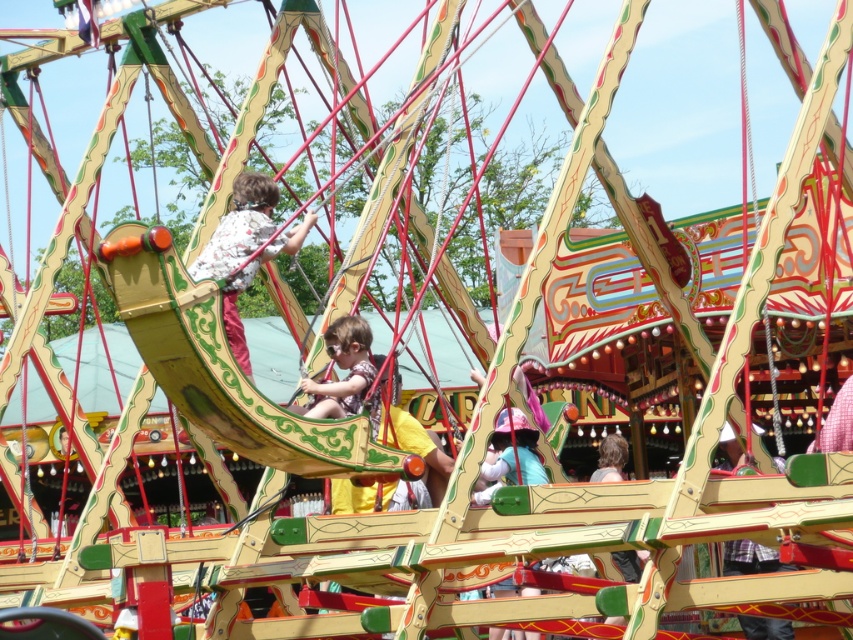
Question: Is floral shirt fabric at center to the right of matte yellow swing at center from the viewer's perspective?

Choices:
 (A) yes
 (B) no

Answer: (B)

Question: Which object appears closest to the camera in this image?

Choices:
 (A) floral shirt fabric at center
 (B) matte yellow swing at center

Answer: (A)

Question: Observing the image, what is the correct spatial positioning of floral shirt fabric at center in reference to matte yellow swing at center?

Choices:
 (A) below
 (B) above

Answer: (B)

Question: Among these points, which one is farthest from the camera?

Choices:
 (A) (312, 410)
 (B) (234, 333)

Answer: (B)

Question: Does floral shirt fabric at center appear on the left side of matte yellow swing at center?

Choices:
 (A) yes
 (B) no

Answer: (A)